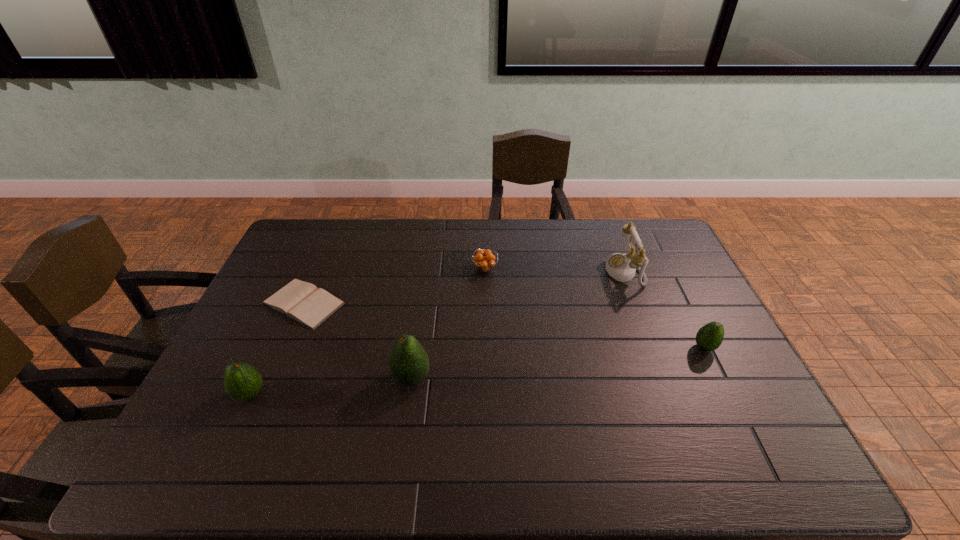
Find the location of `avocado present at the left edge`. avocado present at the left edge is located at coordinates (242, 381).

Locate an element on the screen. This screenshot has height=540, width=960. Bible present at the left edge is located at coordinates (301, 301).

The width and height of the screenshot is (960, 540). Find the location of `avocado that is at the right edge`. avocado that is at the right edge is located at coordinates (709, 337).

You are a GUI agent. You are given a task and a screenshot of the screen. Output one action in this format:
    pyautogui.click(x=<x>, y=<y>)
    Task: Click on the telephone that is at the right edge
    This screenshot has height=540, width=960.
    Given the screenshot: What is the action you would take?
    pyautogui.click(x=622, y=267)

At what (x,y) coordinates should I click in order to perform the action: click on object that is at the near left corner. Please return your answer as a coordinate pair (x, y). Looking at the image, I should click on (242, 381).

Identify the location of object that is positioned at the far right corner. The height and width of the screenshot is (540, 960). (622, 267).

This screenshot has width=960, height=540. Find the location of `vacant point at the far edge`. vacant point at the far edge is located at coordinates (492, 231).

At what (x,y) coordinates should I click in order to perform the action: click on vacant region at the near edge of the desktop. Please return your answer as a coordinate pair (x, y). The width and height of the screenshot is (960, 540). Looking at the image, I should click on (663, 430).

This screenshot has width=960, height=540. I want to click on vacant space at the left edge of the desktop, so click(x=271, y=277).

In the image, there is a desktop. In order to click on free space at the right edge in this screenshot , I will do `click(690, 372)`.